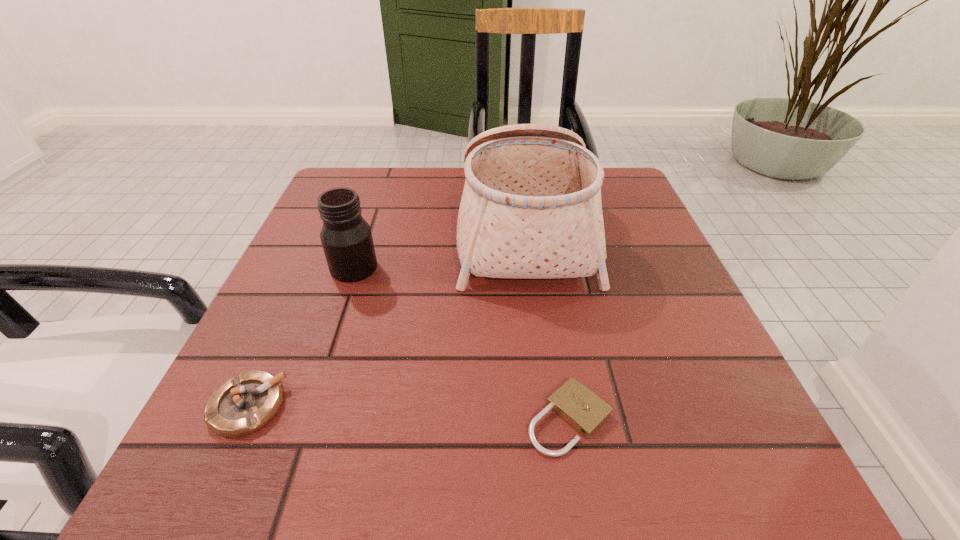
Locate an element on the screen. This screenshot has height=540, width=960. free spot between the shortest object and the jar is located at coordinates (462, 343).

Where is `unoccupied position between the second shortest object and the basket`? This screenshot has width=960, height=540. unoccupied position between the second shortest object and the basket is located at coordinates (386, 318).

Where is `vacant point located between the third tallest object and the basket`? vacant point located between the third tallest object and the basket is located at coordinates (386, 318).

This screenshot has width=960, height=540. In order to click on free area in between the tallest object and the ashtray in this screenshot , I will do tap(386, 318).

Choose which object is the third nearest neighbor to the second shortest object. Please provide its 2D coordinates. Your answer should be formatted as a tuple, i.e. [(x, y)], where the tuple contains the x and y coordinates of a point satisfying the conditions above.

[(585, 411)]

You are a GUI agent. You are given a task and a screenshot of the screen. Output one action in this format:
    pyautogui.click(x=<x>, y=<y>)
    Task: Click on the object that stands as the second closest to the second tallest object
    The height and width of the screenshot is (540, 960).
    Given the screenshot: What is the action you would take?
    pyautogui.click(x=243, y=405)

Locate an element on the screen. The height and width of the screenshot is (540, 960). vacant region that satisfies the following two spatial constraints: 1. on the front side of the shortest object; 2. on the left side of the jar is located at coordinates coord(303,418).

The height and width of the screenshot is (540, 960). Find the location of `vacant area that satisfies the following two spatial constraints: 1. on the back side of the shortest object; 2. with the lid open on the tallest object`. vacant area that satisfies the following two spatial constraints: 1. on the back side of the shortest object; 2. with the lid open on the tallest object is located at coordinates (538, 231).

Find the location of a particular element. This screenshot has height=540, width=960. vacant space that satisfies the following two spatial constraints: 1. on the back side of the shortest object; 2. with the lid open on the basket is located at coordinates (538, 231).

Where is `vacant space that satisfies the following two spatial constraints: 1. with the lid open on the tallest object; 2. on the left side of the shortest object`? Image resolution: width=960 pixels, height=540 pixels. vacant space that satisfies the following two spatial constraints: 1. with the lid open on the tallest object; 2. on the left side of the shortest object is located at coordinates (549, 418).